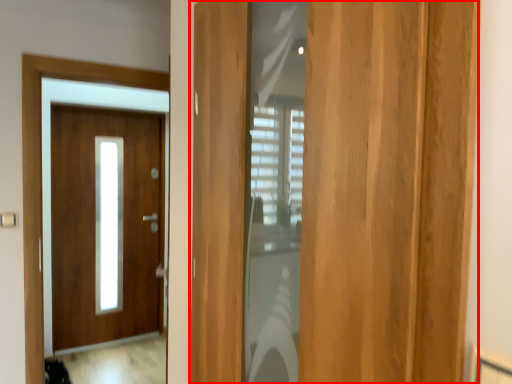
Question: From the image's perspective, what is the correct spatial positioning of door (annotated by the red box) in reference to door?

Choices:
 (A) above
 (B) below

Answer: (A)